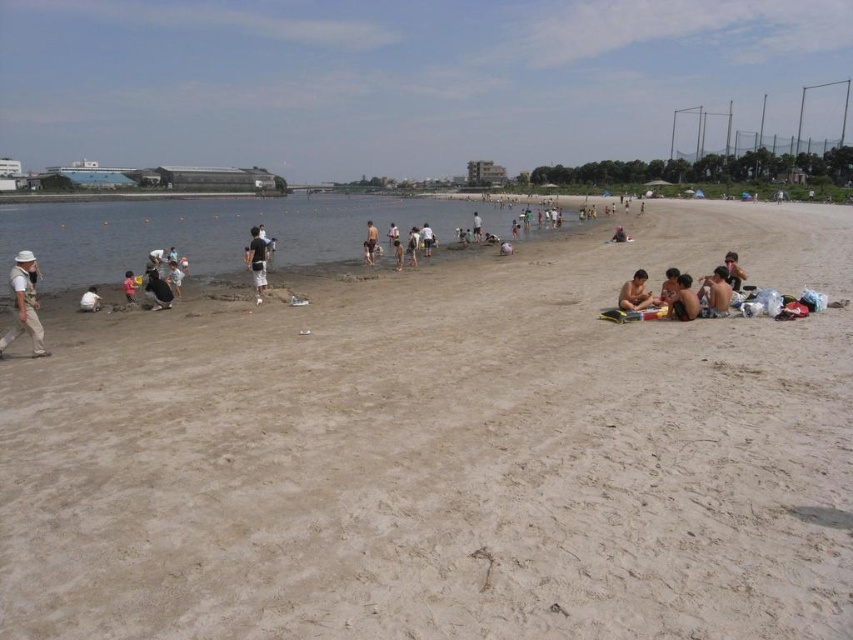
Question: Does clear water at center appear under dark blue shorts at center?

Choices:
 (A) no
 (B) yes

Answer: (A)

Question: Which of these objects is positioned closest to the clear water at center?

Choices:
 (A) light brown sand at center
 (B) dark blue fabric at lower left
 (C) dark blue shorts at center
 (D) smooth tan skin at lower right

Answer: (A)

Question: Which object is closer to the camera taking this photo?

Choices:
 (A) dark blue shirt at lower left
 (B) light brown skin at lower right

Answer: (B)

Question: Which object is the closest to the white fabric bag at lower left?

Choices:
 (A) white cotton shorts at center
 (B) dark blue shorts at center
 (C) light brown skin at lower right

Answer: (A)

Question: Does dark brown skin at lower right appear under dark blue shirt at lower left?

Choices:
 (A) yes
 (B) no

Answer: (A)

Question: Does white cotton shorts at center have a greater width compared to dark blue shirt at lower left?

Choices:
 (A) no
 (B) yes

Answer: (B)